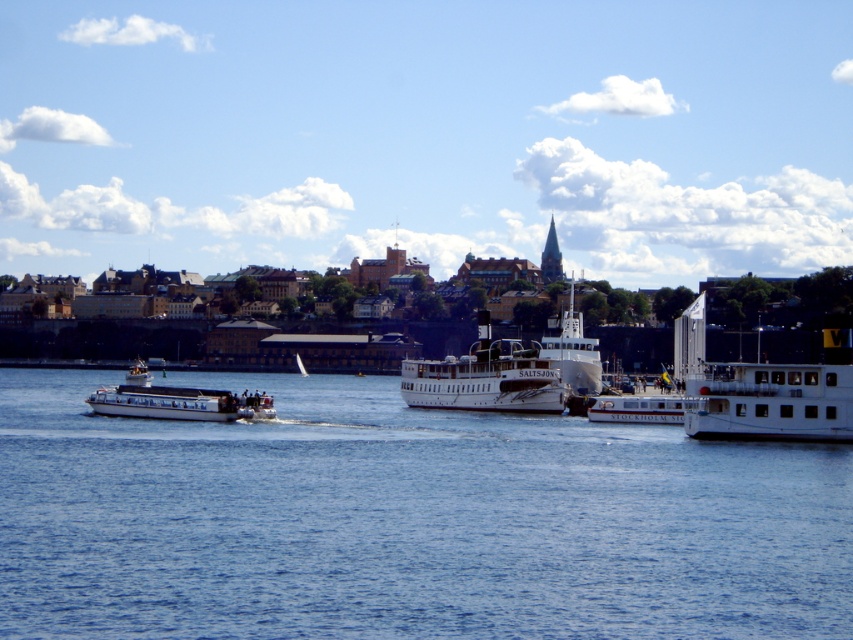
Question: Considering the relative positions of white matte ferry at center and white glossy ferry at center in the image provided, where is white matte ferry at center located with respect to white glossy ferry at center?

Choices:
 (A) right
 (B) left

Answer: (B)

Question: Which of the following is the farthest from the observer?

Choices:
 (A) white glossy ferry at center
 (B) blue water at center
 (C) white glossy boat at left
 (D) white glossy boat at center

Answer: (A)

Question: Which of these objects is positioned closest to the white glossy boat at center?

Choices:
 (A) white glossy boat at left
 (B) blue water at center

Answer: (B)

Question: Which object is positioned closest to the white glossy boat at left?

Choices:
 (A) blue water at center
 (B) white matte ferry at center
 (C) white glossy boat at center
 (D) white glossy ferry at center

Answer: (A)

Question: Can you confirm if blue water at center is thinner than white glossy boat at center?

Choices:
 (A) yes
 (B) no

Answer: (B)

Question: Does white matte ferry at center appear under white glossy boat at center?

Choices:
 (A) no
 (B) yes

Answer: (A)